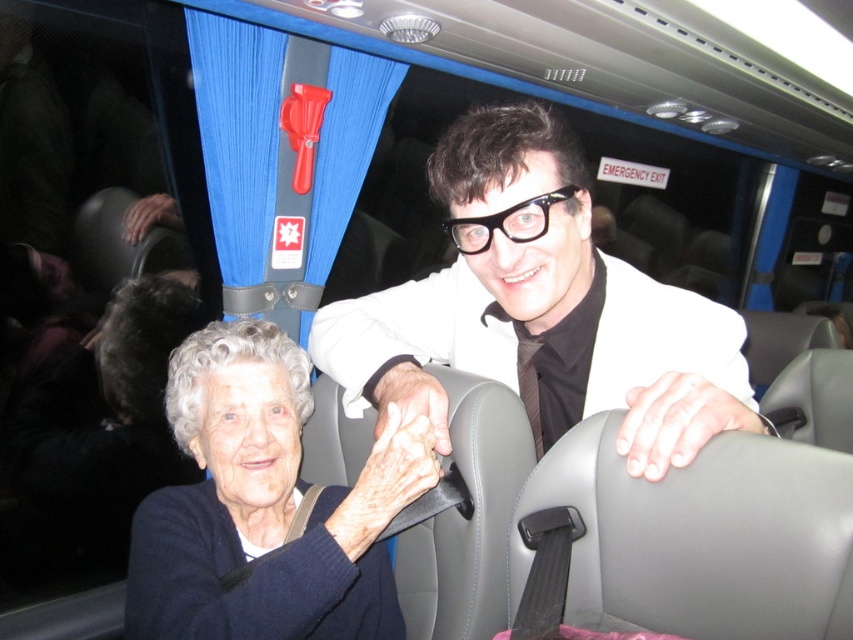
You are a passenger on a bus and need to decide which item is shorter between the white glossy suit at center and the dark blue sweater at lower left. Which one should you choose?

The white glossy suit at center is not as tall as the dark blue sweater at lower left, so the white glossy suit at center is shorter.

You are a passenger on a bus and want to reach the emergency exit handle on the window. You are currently standing near the white glossy suit at center and the dark blue sweater at lower left. Which object is closer to you so you can navigate towards the emergency exit handle?

The white glossy suit at center is closer to the viewer than the dark blue sweater at lower left, so you should move towards the white glossy suit at center first to reach the emergency exit handle.

You are a passenger on a bus and need to know if the white glossy suit at center can fit into the overhead compartment which can only accommodate items wider than the dark blue sweater at lower left. Can it fit?

The white glossy suit at center is wider than the dark blue sweater at lower left, so it cannot fit into the overhead compartment since it exceeds the width requirement.